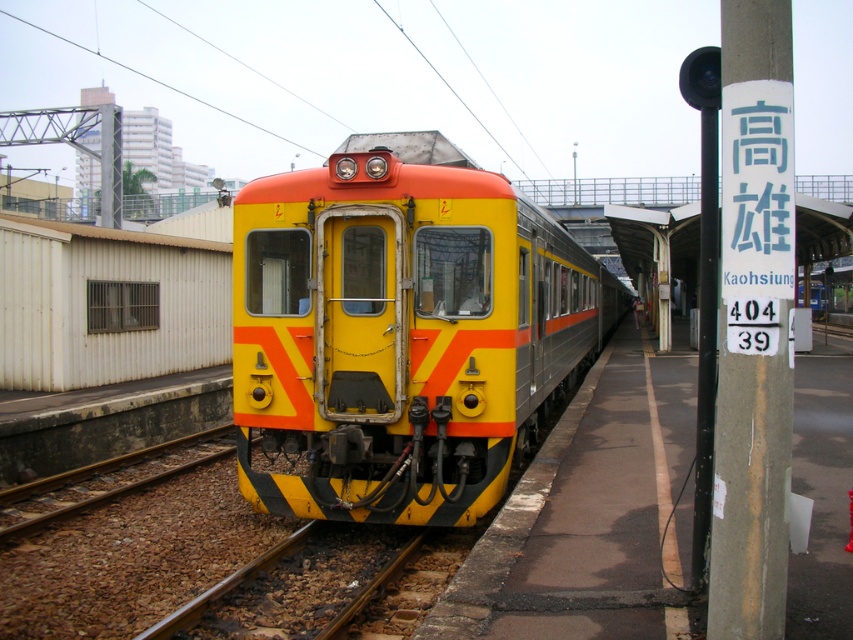
Based on the photo, you are standing at the tactile paving strip on the platform edge. The signpost is on your right. Where is the yellow matte train at center relative to you?

The yellow matte train at center is located at point coordinates of (402,333), so it is positioned to your left side relative to your current position at the tactile paving strip with the signpost on your right.

You are a passenger waiting on the platform and see the yellow matte train at center and the brown gravel at lower left. Which object is closer to the edge of the platform?

The yellow matte train at center is closer to the edge of the platform because it is positioned over the brown gravel at lower left, which is typically near the edge due to the tactile paving strip mentioned in the scene description.

You are a visually impaired person standing on the platform. You feel the tactile paving strip under your feet and want to board the train. Which direction should you walk to reach the yellow matte train at center from the brown gravel at lower left?

Since the brown gravel at lower left is behind the yellow matte train at center, you should walk forward towards the train by moving away from the brown gravel at lower left and towards the platform edge where the tactile paving strip is located. This will lead you directly to the yellow matte train at center.